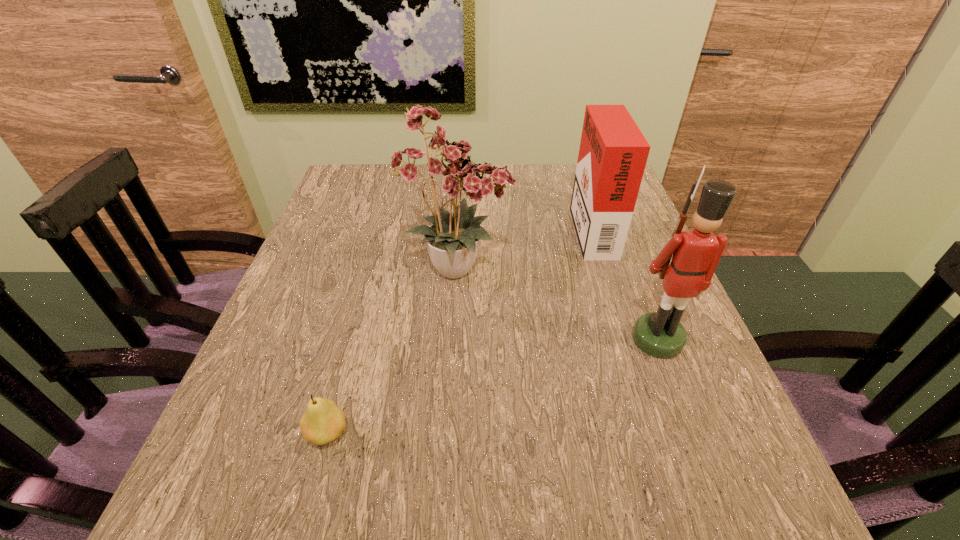
Locate an element on the screen. This screenshot has width=960, height=540. free space located on the right of the leftmost object is located at coordinates (394, 433).

This screenshot has height=540, width=960. Identify the location of object that is at the far edge. (613, 152).

Locate an element on the screen. object at the left edge is located at coordinates (324, 421).

What are the coordinates of `nutcracker that is at the right edge` in the screenshot? It's located at (696, 253).

This screenshot has width=960, height=540. Find the location of `cigarette case situated at the right edge`. cigarette case situated at the right edge is located at coordinates (613, 152).

Locate an element on the screen. object located in the far right corner section of the desktop is located at coordinates (613, 152).

Find the location of a particular element. blank area at the far edge is located at coordinates (525, 168).

The width and height of the screenshot is (960, 540). In the image, there is a desktop. In order to click on free region at the left edge in this screenshot , I will do `click(352, 234)`.

This screenshot has width=960, height=540. In the image, there is a desktop. In order to click on vacant region at the far left corner in this screenshot , I will do `click(389, 176)`.

In order to click on vacant area that lies between the shortest object and the second object from left to right in this screenshot , I will do `click(394, 351)`.